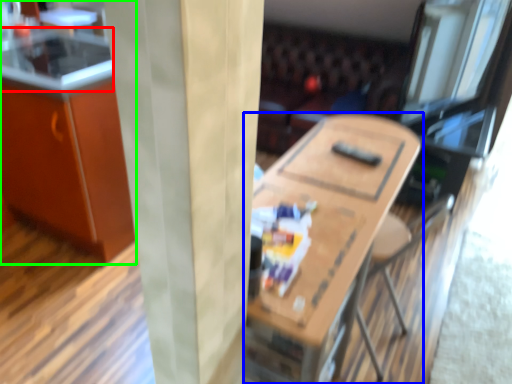
Question: Which is farther away from counter top (highlighted by a red box)? table (highlighted by a blue box) or cabinetry (highlighted by a green box)?

Choices:
 (A) table
 (B) cabinetry

Answer: (A)